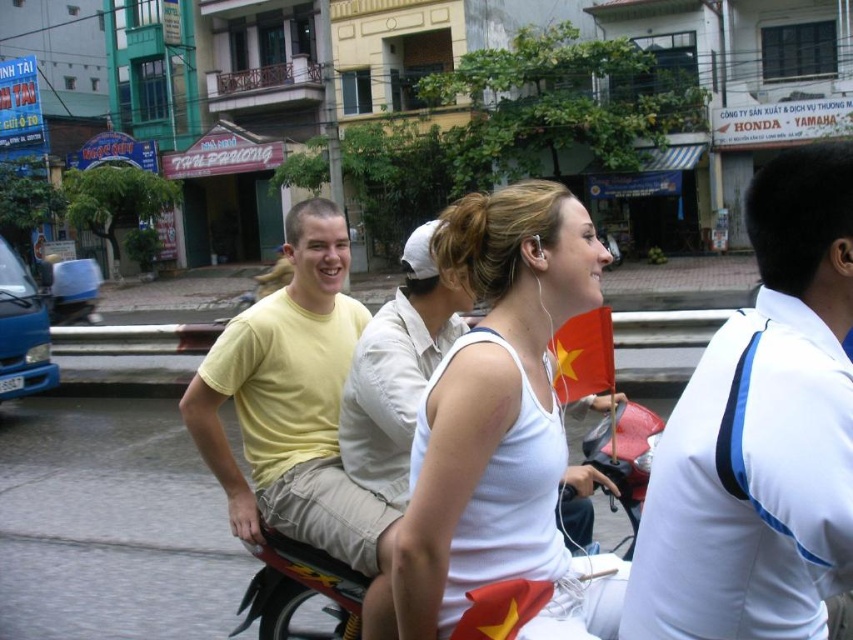
Question: Can you confirm if white smooth shirt at right is positioned to the right of metallic red motorcycle at center?

Choices:
 (A) yes
 (B) no

Answer: (A)

Question: Which point is closer to the camera?

Choices:
 (A) metallic red motorcycle at center
 (B) white matte tank top at center

Answer: (B)

Question: Which object is closer to the camera taking this photo?

Choices:
 (A) white matte tank top at center
 (B) white smooth shirt at right

Answer: (B)

Question: Observing the image, what is the correct spatial positioning of white smooth shirt at right in reference to yellow t-shirt at center?

Choices:
 (A) below
 (B) above

Answer: (B)

Question: Which point is closer to the camera?

Choices:
 (A) white smooth shirt at right
 (B) metallic red motorcycle at center
 (C) white matte tank top at center
 (D) yellow t-shirt at center

Answer: (A)

Question: Does yellow t-shirt at center have a larger size compared to metallic red motorcycle at center?

Choices:
 (A) no
 (B) yes

Answer: (B)